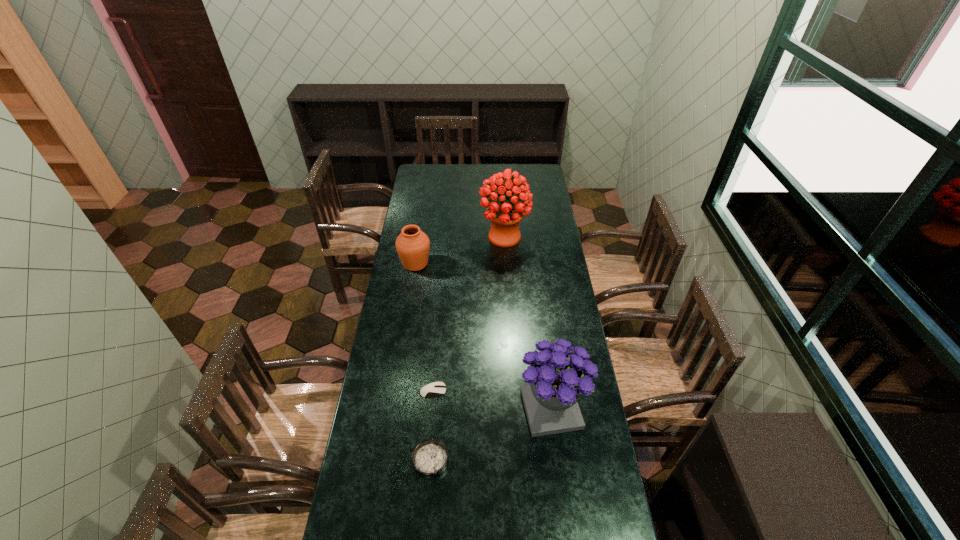
Locate an element on the screen. Image resolution: width=960 pixels, height=540 pixels. free space located 0.120m on the back of the third shortest object is located at coordinates (420, 238).

The width and height of the screenshot is (960, 540). What are the coordinates of `vacant space located on the front of the mouse` in the screenshot? It's located at (422, 514).

Locate an element on the screen. This screenshot has height=540, width=960. vacant position located on the right of the nearest object is located at coordinates (499, 461).

Find the location of a particular element. The height and width of the screenshot is (540, 960). object that is at the left edge is located at coordinates (412, 245).

The width and height of the screenshot is (960, 540). What are the coordinates of `free space at the far edge of the desktop` in the screenshot? It's located at (461, 165).

Where is `blank space at the left edge`? The height and width of the screenshot is (540, 960). blank space at the left edge is located at coordinates (348, 512).

Where is `vacant area at the right edge`? The image size is (960, 540). vacant area at the right edge is located at coordinates (565, 295).

Where is `vacant space at the far right corner`? Image resolution: width=960 pixels, height=540 pixels. vacant space at the far right corner is located at coordinates 538,178.

Identify the location of vacant area that lies between the mouse and the farther bouquet. (468, 314).

Locate an element on the screen. The width and height of the screenshot is (960, 540). vacant space in between the nearer bouquet and the ashtray is located at coordinates (492, 435).